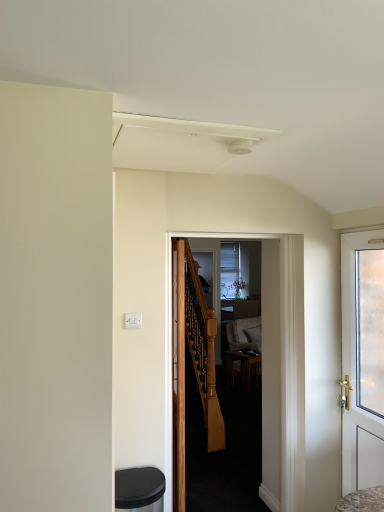
Describe the element at coordinates (178, 374) in the screenshot. I see `wooden door at center, the third door viewed from the right` at that location.

This screenshot has height=512, width=384. Identify the location of wooden door at center, which ranks as the 1th door in left-to-right order. (178, 374).

In order to face wooden door at center, marked as the 2th door in a right-to-left arrangement, should I rotate leftwards or rightwards?

To face it directly, rotate right by 5.580 degrees.

At what (x,y) coordinates should I click in order to perform the action: click on brown wooden table at center. Please return your answer as a coordinate pair (x, y). The image size is (384, 512). Looking at the image, I should click on (243, 367).

Based on the photo, is wooden door at center, marked as the 2th door in a right-to-left arrangement, closer to camera compared to wooden door at center, which ranks as the 1th door in left-to-right order?

That is True.

From a real-world perspective, who is located higher, wooden door at center, which appears as the 2th door when viewed from the left, or wooden door at center, the third door viewed from the right?

wooden door at center, which appears as the 2th door when viewed from the left, is physically above.

How many degrees apart are the facing directions of wooden door at center, marked as the 2th door in a right-to-left arrangement, and wooden door at center, which ranks as the 1th door in left-to-right order?

The angle between the facing direction of wooden door at center, marked as the 2th door in a right-to-left arrangement, and the facing direction of wooden door at center, which ranks as the 1th door in left-to-right order, is 88.8 degrees.

Between wooden door at center, marked as the 2th door in a right-to-left arrangement, and wooden door at center, the third door viewed from the right, which one has larger size?

wooden door at center, marked as the 2th door in a right-to-left arrangement.

Is wooden door at center, marked as the 2th door in a right-to-left arrangement, closer to the viewer compared to brown wooden table at center?

That is True.

From a real-world perspective, which object rests below the other?

In real-world perspective, brown wooden table at center is lower.

Which is more to the right, wooden door at center, which appears as the 2th door when viewed from the left, or brown wooden table at center?

From the viewer's perspective, brown wooden table at center appears more on the right side.

Image resolution: width=384 pixels, height=512 pixels. I want to click on desk on the right of wooden door at center, which appears as the 2th door when viewed from the left, so click(x=243, y=367).

Locate an element on the screen. desk behind the wooden door at center, which ranks as the 1th door in left-to-right order is located at coordinates (243, 367).

From the image's perspective, relative to wooden door at center, which ranks as the 1th door in left-to-right order, is brown wooden table at center above or below?

Clearly, from the image's perspective, brown wooden table at center is below wooden door at center, which ranks as the 1th door in left-to-right order.

Is brown wooden table at center not close to wooden door at center, which appears as the 2th door when viewed from the left?

Indeed, brown wooden table at center is not near wooden door at center, which appears as the 2th door when viewed from the left.

In the image, there is a wooden door at center, marked as the 2th door in a right-to-left arrangement. Identify the location of desk below it (from the image's perspective). (243, 367).

From the image's perspective, between brown wooden table at center and wooden door at center, which appears as the 2th door when viewed from the left, which one is located above?

wooden door at center, which appears as the 2th door when viewed from the left, is shown above in the image.

Can you tell me how much white glossy door at right, which is the first door from right to left, and wooden door at center, marked as the 2th door in a right-to-left arrangement, differ in facing direction?

87.3 degrees.

Is white glossy door at right, which is the first door from right to left, facing towards wooden door at center, which appears as the 2th door when viewed from the left?

No, white glossy door at right, which is the first door from right to left, is not turned towards wooden door at center, which appears as the 2th door when viewed from the left.

Are white glossy door at right, which is the first door from right to left, and wooden door at center, marked as the 2th door in a right-to-left arrangement, beside each other?

white glossy door at right, which is the first door from right to left, is not next to wooden door at center, marked as the 2th door in a right-to-left arrangement, and they're not touching.

From a real-world perspective, between black plastic music stool at lower left and wooden door at center, which ranks as the 1th door in left-to-right order, who is vertically lower?

In real-world perspective, black plastic music stool at lower left is lower.

Image resolution: width=384 pixels, height=512 pixels. Find the location of `the 1st door to the right when counting from the black plastic music stool at lower left`. the 1st door to the right when counting from the black plastic music stool at lower left is located at coordinates (178, 374).

Can you confirm if black plastic music stool at lower left is wider than wooden door at center, the third door viewed from the right?

Yes, black plastic music stool at lower left is wider than wooden door at center, the third door viewed from the right.

Would you say black plastic music stool at lower left is a long distance from wooden door at center, which ranks as the 1th door in left-to-right order?

black plastic music stool at lower left is near wooden door at center, which ranks as the 1th door in left-to-right order, not far away.

Is point (182, 286) positioned after point (264, 433)?

Yes, it is behind point (264, 433).

Which object is wider, wooden door at center, the third door viewed from the right, or wooden door at center, marked as the 2th door in a right-to-left arrangement?

With larger width is wooden door at center, the third door viewed from the right.

Can you tell me how much wooden door at center, which ranks as the 1th door in left-to-right order, and wooden door at center, which appears as the 2th door when viewed from the left, differ in facing direction?

The facing directions of wooden door at center, which ranks as the 1th door in left-to-right order, and wooden door at center, which appears as the 2th door when viewed from the left, are 88.8 degrees apart.

From the image's perspective, is wooden door at center, which ranks as the 1th door in left-to-right order, under wooden door at center, marked as the 2th door in a right-to-left arrangement?

Correct, wooden door at center, which ranks as the 1th door in left-to-right order, appears lower than wooden door at center, marked as the 2th door in a right-to-left arrangement, in the image.

Locate an element on the screen. This screenshot has width=384, height=512. the 1st door above the wooden door at center, which ranks as the 1th door in left-to-right order (from a real-world perspective) is located at coordinates pyautogui.click(x=281, y=368).

Image resolution: width=384 pixels, height=512 pixels. Identify the location of desk lying below the wooden door at center, which appears as the 2th door when viewed from the left (from the image's perspective). 243,367.

Estimate the real-world distances between objects in this image. Which object is further from white glossy door at right, which is the first door from right to left, wooden door at center, marked as the 2th door in a right-to-left arrangement, or brown wooden table at center?

brown wooden table at center lies further to white glossy door at right, which is the first door from right to left, than the other object.

From the image, which object appears to be farther from brown wooden table at center, wooden door at center, marked as the 2th door in a right-to-left arrangement, or white glossy door at right, which is the first door from right to left?

white glossy door at right, which is the first door from right to left, is further to brown wooden table at center.

When comparing their distances from wooden door at center, which ranks as the 1th door in left-to-right order, does white glossy door at right, which is the first door from right to left, or brown wooden table at center seem closer?

Among the two, white glossy door at right, which is the first door from right to left, is located nearer to wooden door at center, which ranks as the 1th door in left-to-right order.

When comparing their distances from wooden door at center, marked as the 2th door in a right-to-left arrangement, does white glossy door at right, which ranks as the 3th door in left-to-right order, or black plastic music stool at lower left seem closer?

Among the two, white glossy door at right, which ranks as the 3th door in left-to-right order, is located nearer to wooden door at center, marked as the 2th door in a right-to-left arrangement.

Based on the photo, looking at the image, which one is located closer to brown wooden table at center, wooden door at center, which ranks as the 1th door in left-to-right order, or black plastic music stool at lower left?

Among the two, wooden door at center, which ranks as the 1th door in left-to-right order, is located nearer to brown wooden table at center.

Considering their positions, is wooden door at center, which appears as the 2th door when viewed from the left, positioned closer to white glossy door at right, which is the first door from right to left, than black plastic music stool at lower left?

wooden door at center, which appears as the 2th door when viewed from the left, is closer to white glossy door at right, which is the first door from right to left.

Considering their positions, is white glossy door at right, which ranks as the 3th door in left-to-right order, positioned closer to brown wooden table at center than wooden door at center, which appears as the 2th door when viewed from the left?

wooden door at center, which appears as the 2th door when viewed from the left.

Estimate the real-world distances between objects in this image. Which object is further from black plastic music stool at lower left, brown wooden table at center or white glossy door at right, which is the first door from right to left?

brown wooden table at center is positioned further to the anchor black plastic music stool at lower left.

Identify the location of door positioned between wooden door at center, which appears as the 2th door when viewed from the left, and brown wooden table at center from near to far. (178, 374).

What are the coordinates of `door between wooden door at center, which ranks as the 1th door in left-to-right order, and white glossy door at right, which is the first door from right to left, in the horizontal direction` in the screenshot? It's located at (281, 368).